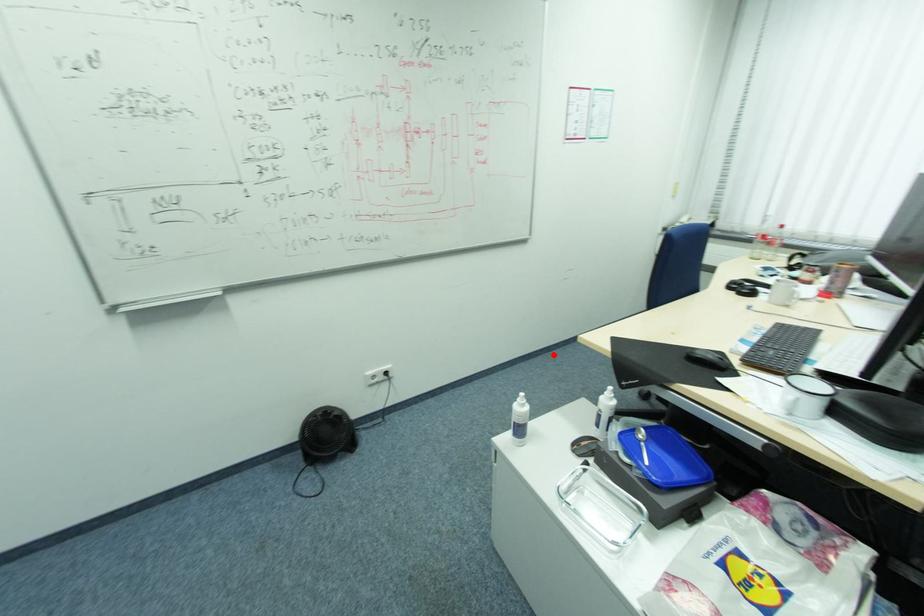
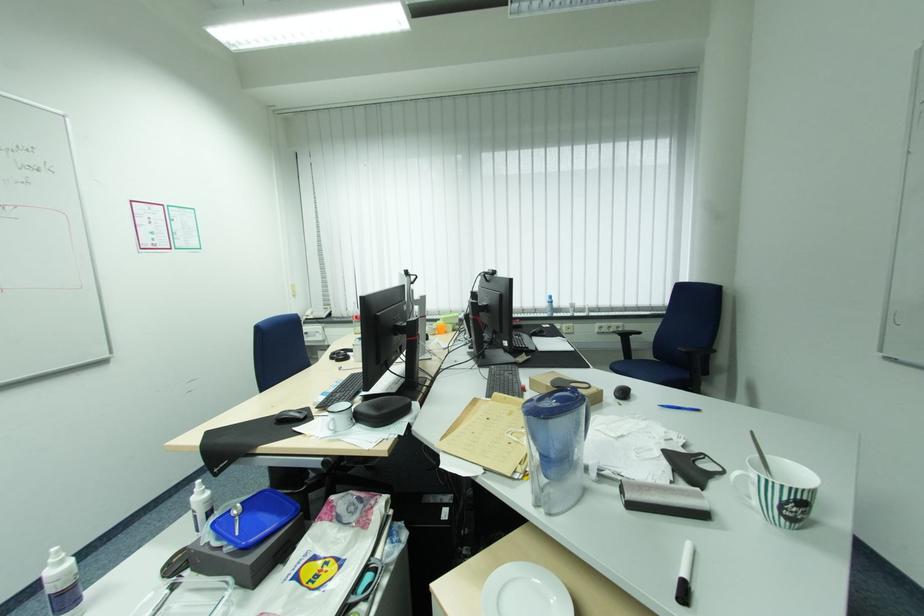
Find the pixel in the second image that matches the highlighted location in the first image.

(193, 487)